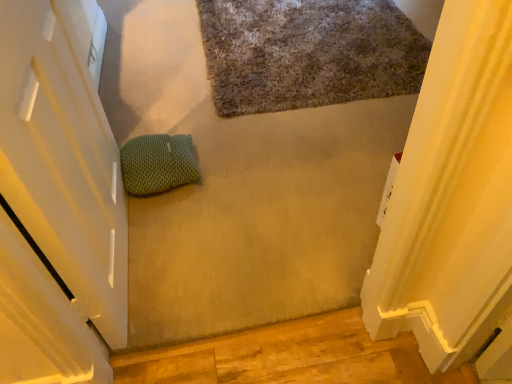
Question: Is green mesh pillow at center positioned far away from textured gray bath mat at upper center?

Choices:
 (A) no
 (B) yes

Answer: (A)

Question: Is the depth of green mesh pillow at center greater than that of textured gray bath mat at upper center?

Choices:
 (A) yes
 (B) no

Answer: (B)

Question: Considering the relative sizes of green mesh pillow at center and textured gray bath mat at upper center in the image provided, is green mesh pillow at center wider than textured gray bath mat at upper center?

Choices:
 (A) no
 (B) yes

Answer: (A)

Question: Does green mesh pillow at center have a greater height compared to textured gray bath mat at upper center?

Choices:
 (A) no
 (B) yes

Answer: (B)

Question: Is green mesh pillow at center surrounding textured gray bath mat at upper center?

Choices:
 (A) yes
 (B) no

Answer: (B)

Question: Is green mesh pillow at center at the right side of textured gray bath mat at upper center?

Choices:
 (A) no
 (B) yes

Answer: (A)

Question: Is textured gray bath mat at upper center thinner than green mesh pillow at center?

Choices:
 (A) yes
 (B) no

Answer: (B)

Question: Is textured gray bath mat at upper center to the left of green mesh pillow at center from the viewer's perspective?

Choices:
 (A) no
 (B) yes

Answer: (A)

Question: Is textured gray bath mat at upper center taller than green mesh pillow at center?

Choices:
 (A) yes
 (B) no

Answer: (B)

Question: Can you confirm if textured gray bath mat at upper center is positioned to the right of green mesh pillow at center?

Choices:
 (A) no
 (B) yes

Answer: (B)

Question: Considering the relative sizes of textured gray bath mat at upper center and green mesh pillow at center in the image provided, is textured gray bath mat at upper center smaller than green mesh pillow at center?

Choices:
 (A) yes
 (B) no

Answer: (B)

Question: Is textured gray bath mat at upper center bigger than green mesh pillow at center?

Choices:
 (A) yes
 (B) no

Answer: (A)

Question: Is textured gray bath mat at upper center inside the boundaries of green mesh pillow at center, or outside?

Choices:
 (A) inside
 (B) outside

Answer: (B)